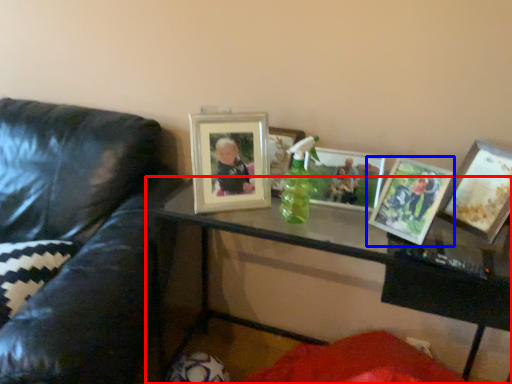
Question: Which object appears closest to the camera in this image, table (highlighted by a red box) or picture frame (highlighted by a blue box)?

Choices:
 (A) table
 (B) picture frame

Answer: (A)